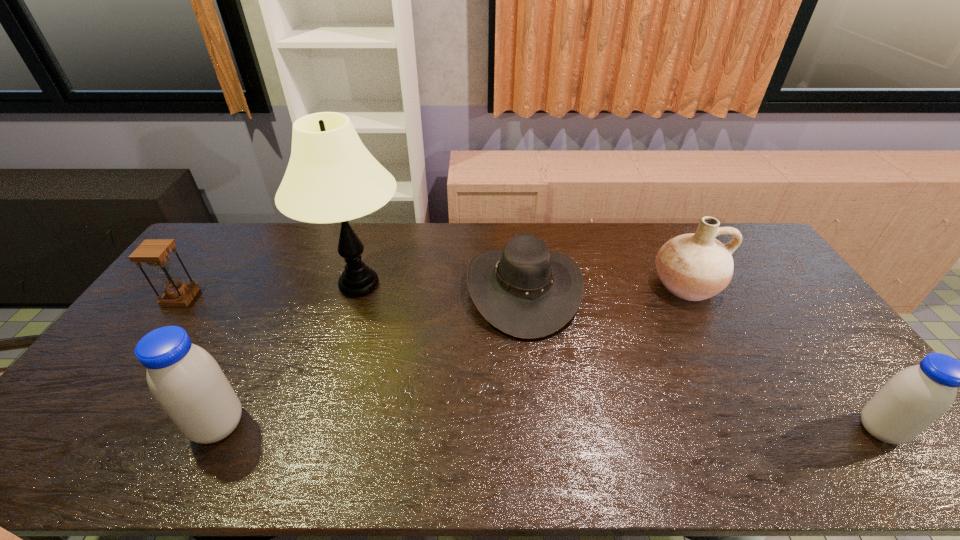
Where is `lamp present at the far edge`? lamp present at the far edge is located at coordinates (331, 177).

The image size is (960, 540). Find the location of `object that is positioned at the left edge`. object that is positioned at the left edge is located at coordinates (155, 252).

Identify the location of object that is at the right edge. (914, 398).

Find the location of a particular element. The width and height of the screenshot is (960, 540). object at the near right corner is located at coordinates (914, 398).

The height and width of the screenshot is (540, 960). What are the coordinates of `vacant space at the far edge of the desktop` in the screenshot? It's located at (488, 225).

The image size is (960, 540). In order to click on free space at the near edge of the desktop in this screenshot , I will do `click(458, 429)`.

Where is `vacant region at the left edge`? Image resolution: width=960 pixels, height=540 pixels. vacant region at the left edge is located at coordinates (105, 379).

Identify the location of free space at the right edge of the desktop. (757, 305).

This screenshot has width=960, height=540. I want to click on free space at the far left corner of the desktop, so click(231, 229).

At what (x,y) coordinates should I click in order to perform the action: click on free space between the shorter soya milk and the cowboy hat. Please return your answer as a coordinate pair (x, y). This screenshot has width=960, height=540. Looking at the image, I should click on (702, 360).